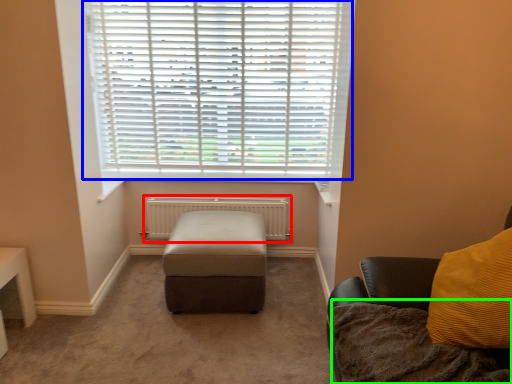
Question: Based on their relative distances, which object is nearer to radiator (highlighted by a red box)? Choose from window blind (highlighted by a blue box) and blanket (highlighted by a green box).

Choices:
 (A) window blind
 (B) blanket

Answer: (A)